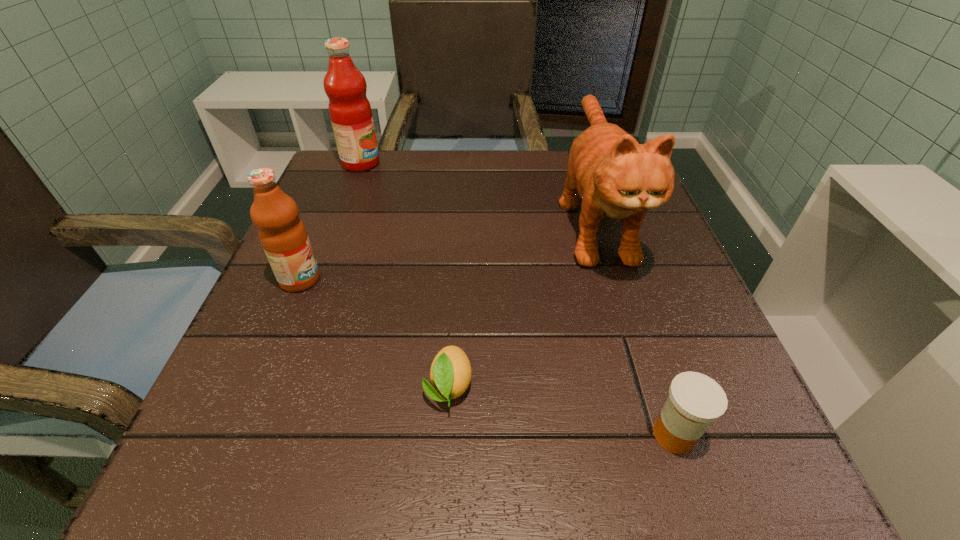
The image size is (960, 540). What are the coordinates of `free spot between the third tallest object and the cat` in the screenshot? It's located at pyautogui.click(x=447, y=248).

You are a GUI agent. You are given a task and a screenshot of the screen. Output one action in this format:
    pyautogui.click(x=<x>, y=<y>)
    Task: Click on the vacant space that is in between the second shortest object and the cat
    
    Given the screenshot: What is the action you would take?
    pyautogui.click(x=635, y=326)

Where is `vacant space that is in between the taller fruit juice and the nearer fruit juice`? The width and height of the screenshot is (960, 540). vacant space that is in between the taller fruit juice and the nearer fruit juice is located at coordinates (330, 221).

Where is `free space that is in between the taller fruit juice and the shortest object`? free space that is in between the taller fruit juice and the shortest object is located at coordinates (405, 275).

Find the location of a particular element. vacant area that lies between the third shortest object and the cat is located at coordinates pyautogui.click(x=447, y=248).

This screenshot has height=540, width=960. Find the location of `blank region between the shortest object and the cat`. blank region between the shortest object and the cat is located at coordinates (521, 302).

Where is `vacant space that's between the shortest object and the farther fruit juice`? This screenshot has width=960, height=540. vacant space that's between the shortest object and the farther fruit juice is located at coordinates (405, 275).

Identify which object is the third closest to the third object from left to right. Please provide its 2D coordinates. Your answer should be formatted as a tuple, i.e. [(x, y)], where the tuple contains the x and y coordinates of a point satisfying the conditions above.

[(283, 236)]

Locate which object is the fourth closest to the fourth tallest object. Please provide its 2D coordinates. Your answer should be formatted as a tuple, i.e. [(x, y)], where the tuple contains the x and y coordinates of a point satisfying the conditions above.

[(350, 112)]

Find the location of `vacant position in the image that satisfies the following two spatial constraints: 1. on the face of the cat; 2. on the front label of the nearer fruit juice`. vacant position in the image that satisfies the following two spatial constraints: 1. on the face of the cat; 2. on the front label of the nearer fruit juice is located at coordinates (613, 279).